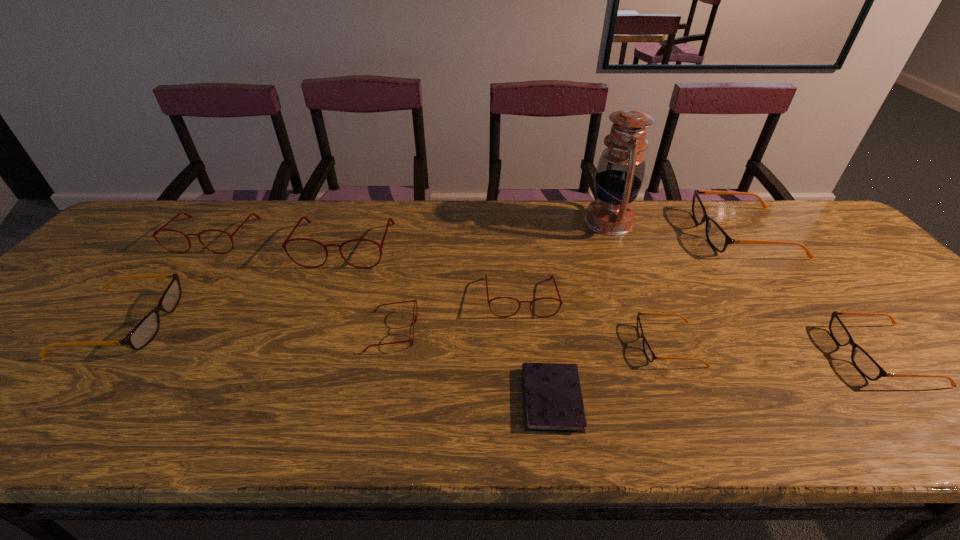
Where is `blank area in the image that satisfies the following two spatial constraints: 1. on the face of the diary; 2. on the right side of the fifth spectacles from left to right`? blank area in the image that satisfies the following two spatial constraints: 1. on the face of the diary; 2. on the right side of the fifth spectacles from left to right is located at coordinates (531, 399).

In order to click on free location that satisfies the following two spatial constraints: 1. on the face of the second smallest red spectacles; 2. on the front-facing side of the leftmost black spectacles in this screenshot , I will do `click(523, 322)`.